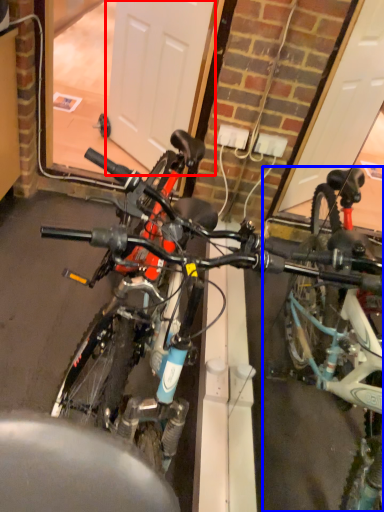
Question: Which object is further to the camera taking this photo, garage door (highlighted by a red box) or bicycle (highlighted by a blue box)?

Choices:
 (A) garage door
 (B) bicycle

Answer: (A)